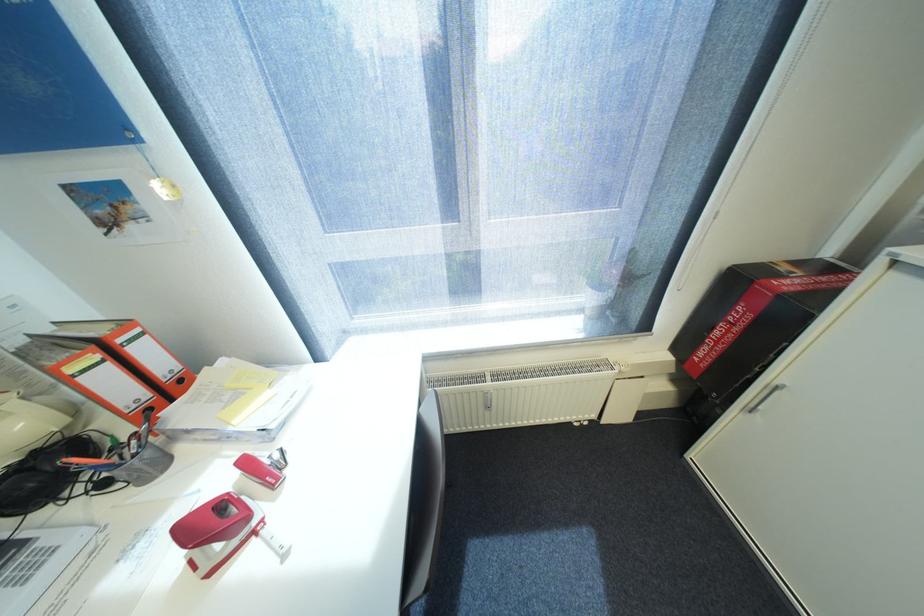
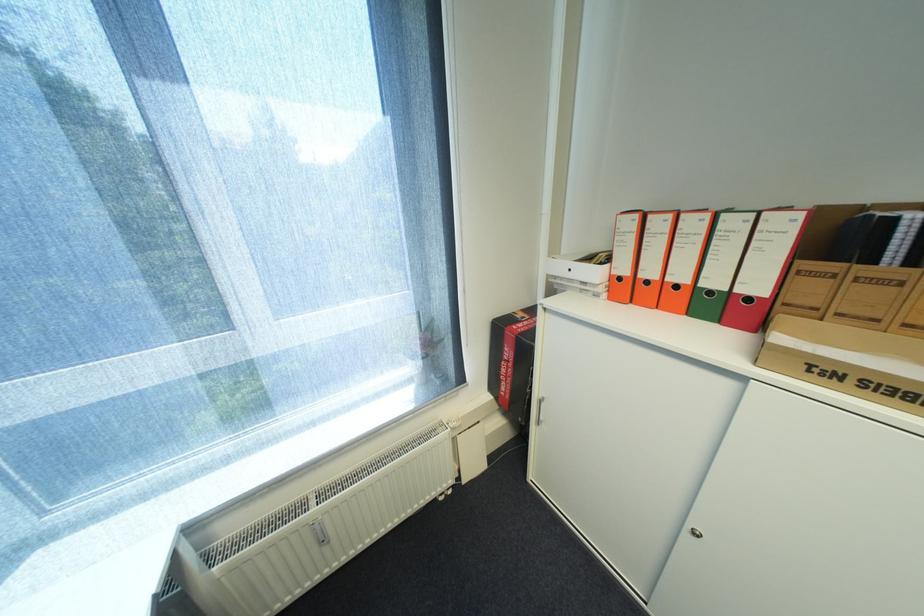
Question: The camera is either moving clockwise (left) or counter-clockwise (right) around the object. The first image is from the beginning of the video and the second image is from the end. Is the camera moving left or right when shooting the video?

Choices:
 (A) Left
 (B) Right

Answer: (A)